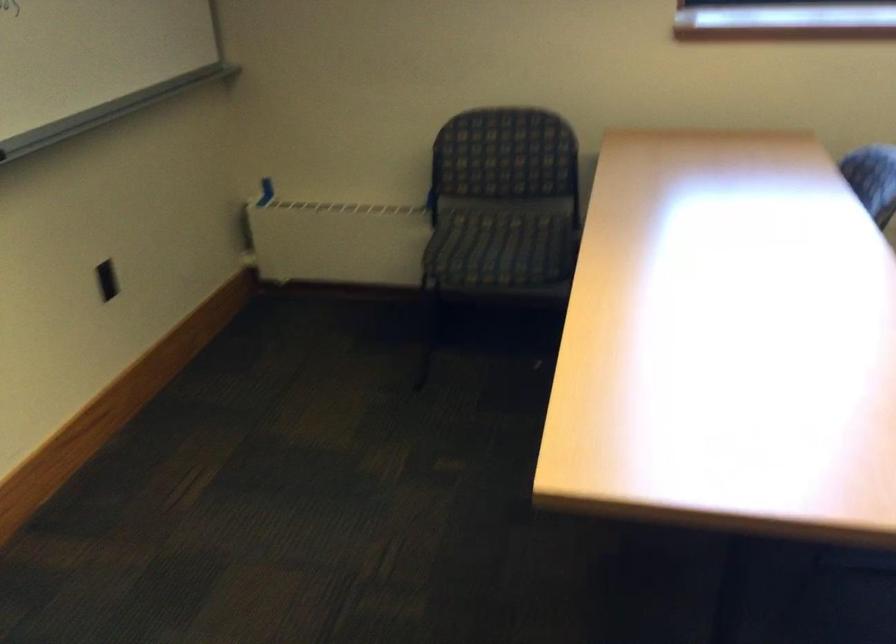
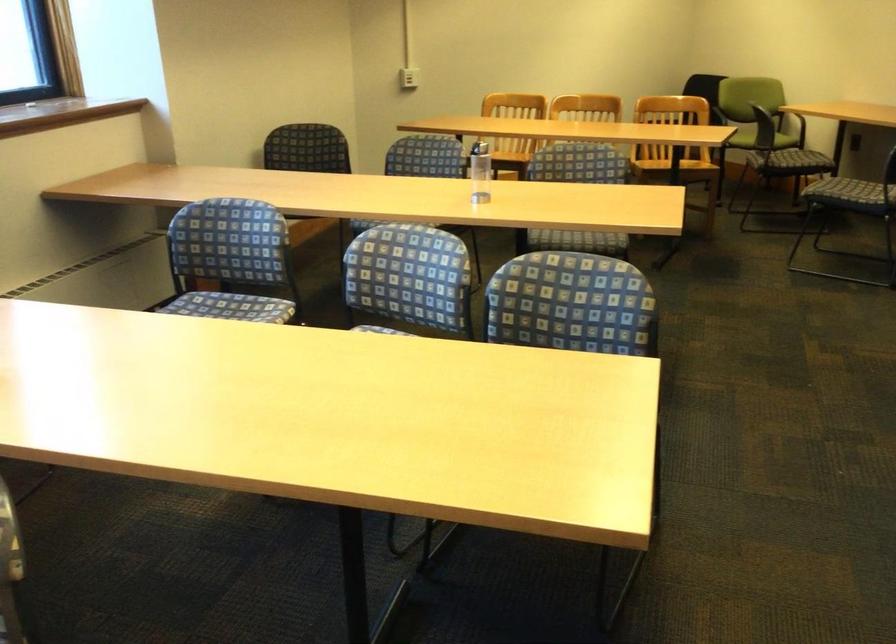
Question: The camera is either moving clockwise (left) or counter-clockwise (right) around the object. The first image is from the beginning of the video and the second image is from the end. Is the camera moving left or right when shooting the video?

Choices:
 (A) Left
 (B) Right

Answer: (A)